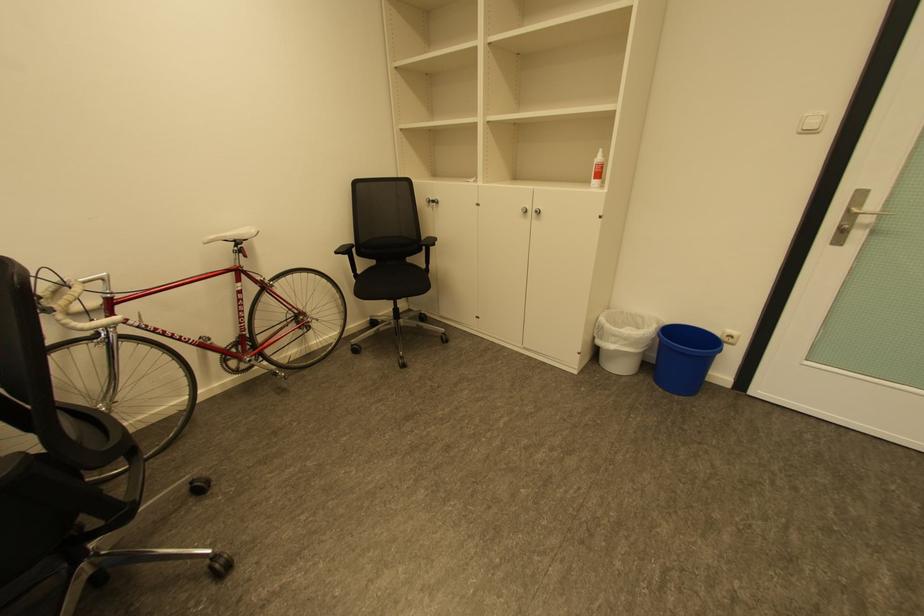
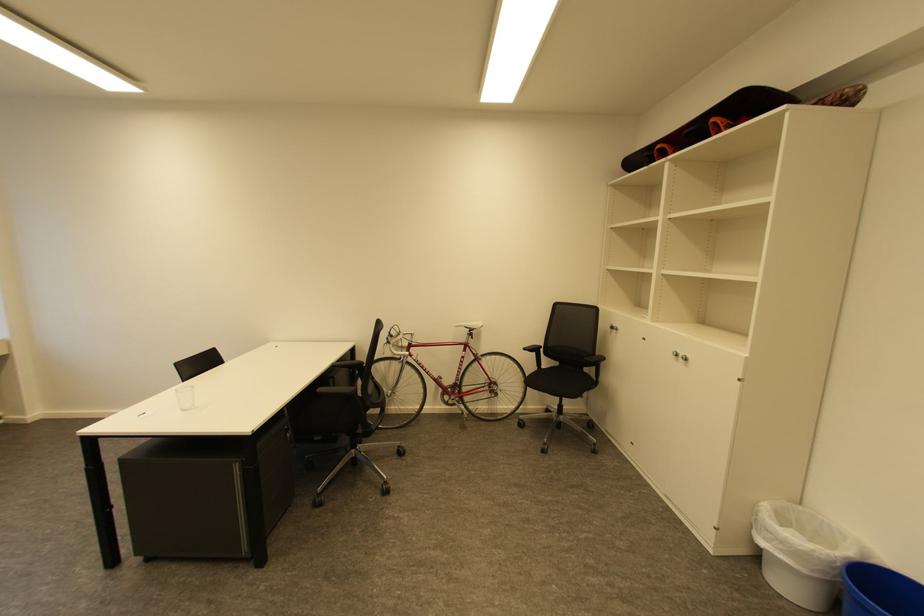
Find the pixel in the second image that matches point (622, 337) in the first image.

(775, 533)